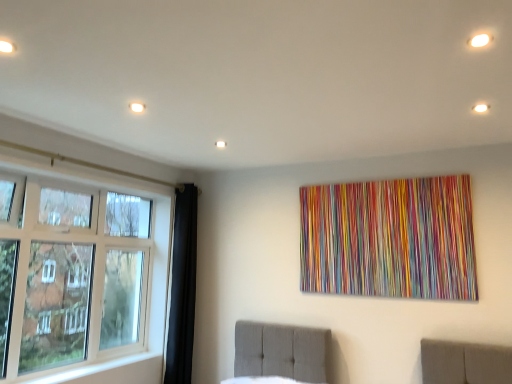
Question: Is white glass window at left completely or partially inside white glossy light at upper right, marked as the 1th light in a right-to-left arrangement?

Choices:
 (A) no
 (B) yes

Answer: (A)

Question: Can you see white glossy light at upper right, which is the second light from left to right, touching white glass window at left?

Choices:
 (A) no
 (B) yes

Answer: (A)

Question: Can you confirm if white glossy light at upper right, marked as the 1th light in a right-to-left arrangement, is smaller than white glass window at left?

Choices:
 (A) yes
 (B) no

Answer: (A)

Question: Is white glossy light at upper right, marked as the 1th light in a right-to-left arrangement, further to the viewer compared to white glass window at left?

Choices:
 (A) yes
 (B) no

Answer: (B)

Question: Is white glossy light at upper right, which is the second light from left to right, not within white glass window at left?

Choices:
 (A) no
 (B) yes

Answer: (B)

Question: Would you say white matte light fixture at upper left, the second light in the right-to-left sequence, is to the left or to the right of white glossy light at upper right, marked as the 1th light in a right-to-left arrangement, in the picture?

Choices:
 (A) left
 (B) right

Answer: (A)

Question: Would you say white matte light fixture at upper left, the second light in the right-to-left sequence, is inside or outside white glossy light at upper right, which is the second light from left to right?

Choices:
 (A) outside
 (B) inside

Answer: (A)

Question: Is white matte light fixture at upper left, the 1th light positioned from the left, taller or shorter than white glossy light at upper right, which is the second light from left to right?

Choices:
 (A) short
 (B) tall

Answer: (A)

Question: Looking at the image, does white matte light fixture at upper left, the second light in the right-to-left sequence, seem bigger or smaller compared to white glossy light at upper right, which is the second light from left to right?

Choices:
 (A) big
 (B) small

Answer: (B)

Question: In the image, is white glass window at left positioned in front of or behind white glossy light at upper right, which is the second light from left to right?

Choices:
 (A) front
 (B) behind

Answer: (B)

Question: From the image's perspective, is white glass window at left positioned above or below white glossy light at upper right, marked as the 1th light in a right-to-left arrangement?

Choices:
 (A) below
 (B) above

Answer: (A)

Question: Looking at the image, does white glass window at left seem bigger or smaller compared to white glossy light at upper right, which is the second light from left to right?

Choices:
 (A) big
 (B) small

Answer: (A)

Question: From a real-world perspective, is white glass window at left above or below white glossy light at upper right, marked as the 1th light in a right-to-left arrangement?

Choices:
 (A) below
 (B) above

Answer: (A)

Question: In terms of width, does white glass window at left look wider or thinner when compared to white matte light fixture at upper left, the 1th light positioned from the left?

Choices:
 (A) thin
 (B) wide

Answer: (B)

Question: From a real-world perspective, is white glass window at left physically located above or below white matte light fixture at upper left, the second light in the right-to-left sequence?

Choices:
 (A) below
 (B) above

Answer: (A)